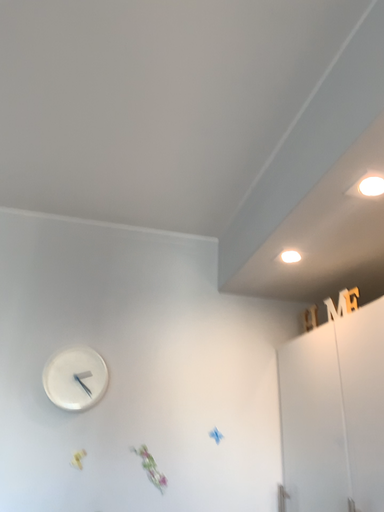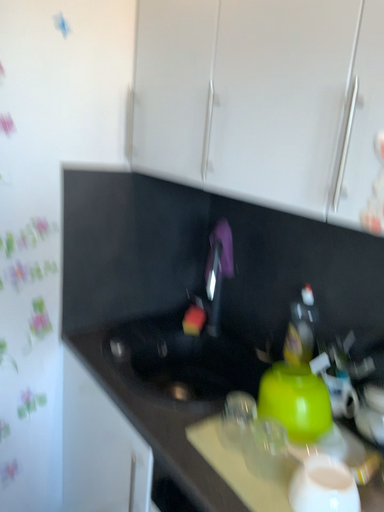
Question: How did the camera likely rotate when shooting the video?

Choices:
 (A) rotated upward
 (B) rotated downward

Answer: (B)